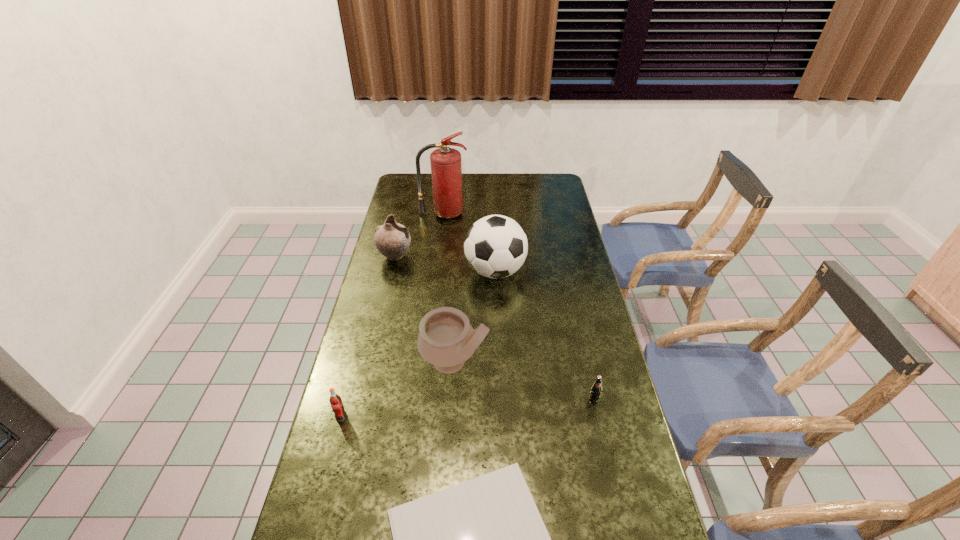
Find the location of a particular element. The height and width of the screenshot is (540, 960). the farthest object is located at coordinates coord(446,169).

Locate an element on the screen. the tallest object is located at coordinates coord(446,169).

You are a GUI agent. You are given a task and a screenshot of the screen. Output one action in this format:
    pyautogui.click(x=<x>, y=<y>)
    Task: Click on the soccer ball
    
    Given the screenshot: What is the action you would take?
    [495, 246]

The width and height of the screenshot is (960, 540). In order to click on the right pottery in this screenshot , I will do `click(446, 339)`.

The width and height of the screenshot is (960, 540). I want to click on the nearer pottery, so click(446, 339).

At what (x,y) coordinates should I click in order to perform the action: click on the left pottery. Please return your answer as a coordinate pair (x, y). This screenshot has height=540, width=960. Looking at the image, I should click on (392, 240).

This screenshot has width=960, height=540. I want to click on the nearer pop, so click(335, 400).

You are a GUI agent. You are given a task and a screenshot of the screen. Output one action in this format:
    pyautogui.click(x=<x>, y=<y>)
    Task: Click on the sixth farthest object
    This screenshot has width=960, height=540.
    Given the screenshot: What is the action you would take?
    pyautogui.click(x=335, y=400)

Image resolution: width=960 pixels, height=540 pixels. What are the coordinates of `the sixth tallest object` in the screenshot? It's located at (595, 391).

Where is `the right pop`? This screenshot has width=960, height=540. the right pop is located at coordinates (595, 391).